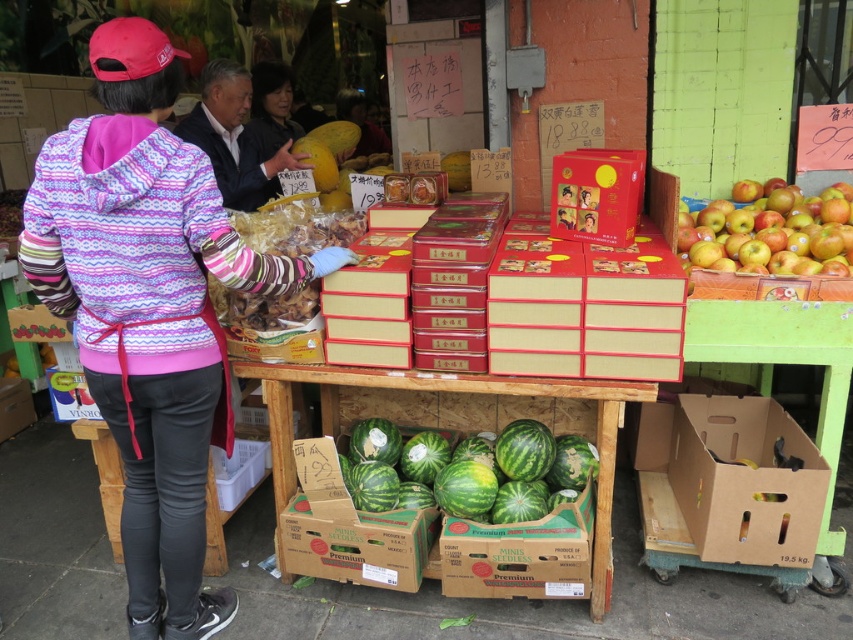
Question: Does brown cardboard boxes at center appear on the right side of matte red box at upper center?

Choices:
 (A) no
 (B) yes

Answer: (A)

Question: Is pink fleece jacket at left bigger than green striped watermelon at center?

Choices:
 (A) no
 (B) yes

Answer: (B)

Question: Which point is closer to the camera?

Choices:
 (A) (596, 212)
 (B) (459, 476)
 (C) (817, 202)

Answer: (A)

Question: Does green textured watermelons at center appear under green matte watermelon at center?

Choices:
 (A) no
 (B) yes

Answer: (A)

Question: Which point is closer to the camera?

Choices:
 (A) (769, 214)
 (B) (379, 387)
 (C) (505, 452)

Answer: (B)

Question: Which point is farther to the camera?

Choices:
 (A) green cardboard box at lower center
 (B) matte red box at upper center

Answer: (B)